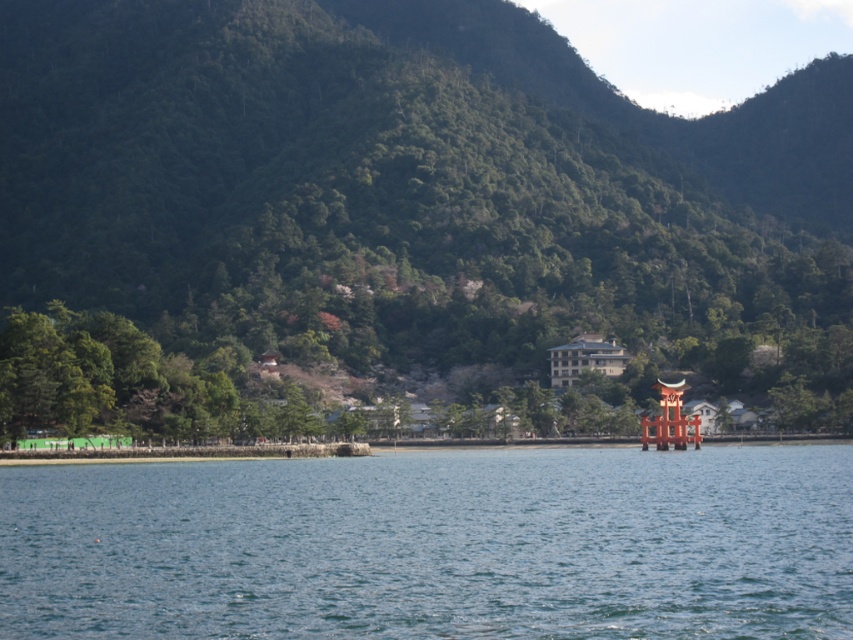
Which is behind, point (752, 320) or point (196, 476)?

The point (752, 320) is more distant.

The image size is (853, 640). What are the coordinates of `green leafy mountain at upper center` in the screenshot? It's located at (397, 212).

Does point (422, 268) come behind point (136, 628)?

Yes, it is behind point (136, 628).

Find the location of a particular element. Image resolution: width=853 pixels, height=640 pixels. green leafy mountain at upper center is located at coordinates (397, 212).